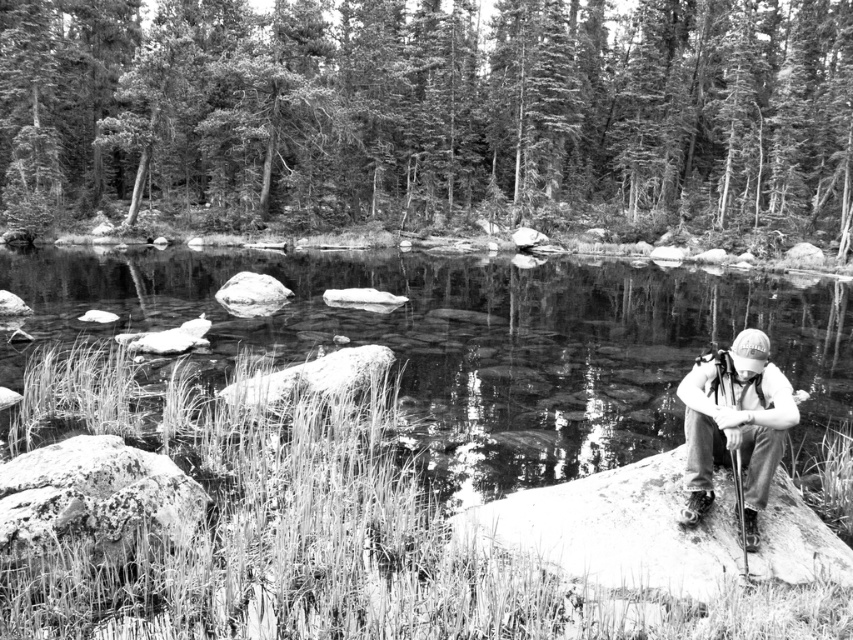
You are a photographer trying to capture the reflection of the white fabric cap at right in the water. Since the smooth granite boulder at right is blocking part of the view, will you need to adjust your position to get a clear shot of the cap?

The smooth granite boulder at right is not as tall as the white fabric cap at right, so adjusting your position slightly might allow you to see over the boulder and capture the reflection of the white fabric cap at right in the water.